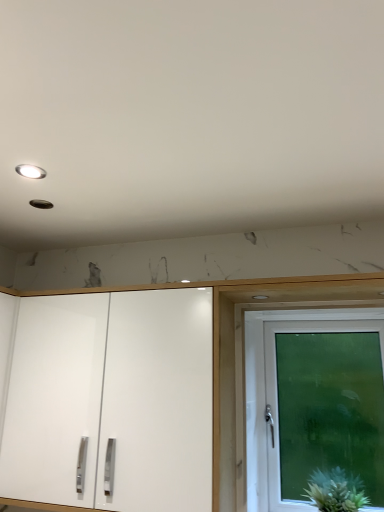
Question: In the image, is white glass door at right on the left side or the right side of green fuzzy plant at lower right?

Choices:
 (A) left
 (B) right

Answer: (B)

Question: In terms of size, does white glass door at right appear bigger or smaller than green fuzzy plant at lower right?

Choices:
 (A) big
 (B) small

Answer: (A)

Question: Which is farther from the white glass door at right?

Choices:
 (A) matte white light fixture at upper left
 (B) green fuzzy plant at lower right
 (C) white glossy cabinet doors at center

Answer: (A)

Question: Based on their relative distances, which object is farther from the white glossy cabinet doors at center?

Choices:
 (A) matte white light fixture at upper left
 (B) white glass door at right
 (C) green fuzzy plant at lower right

Answer: (A)